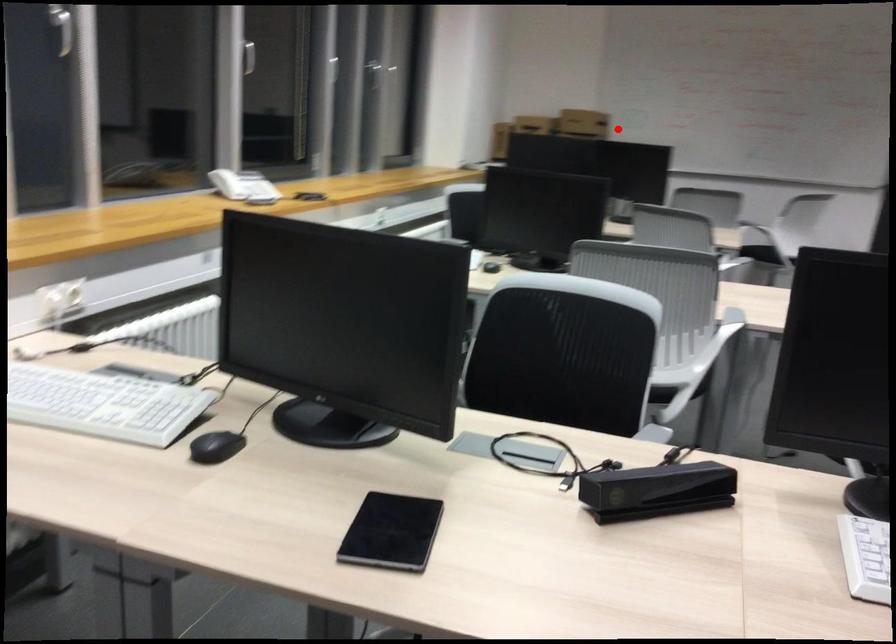
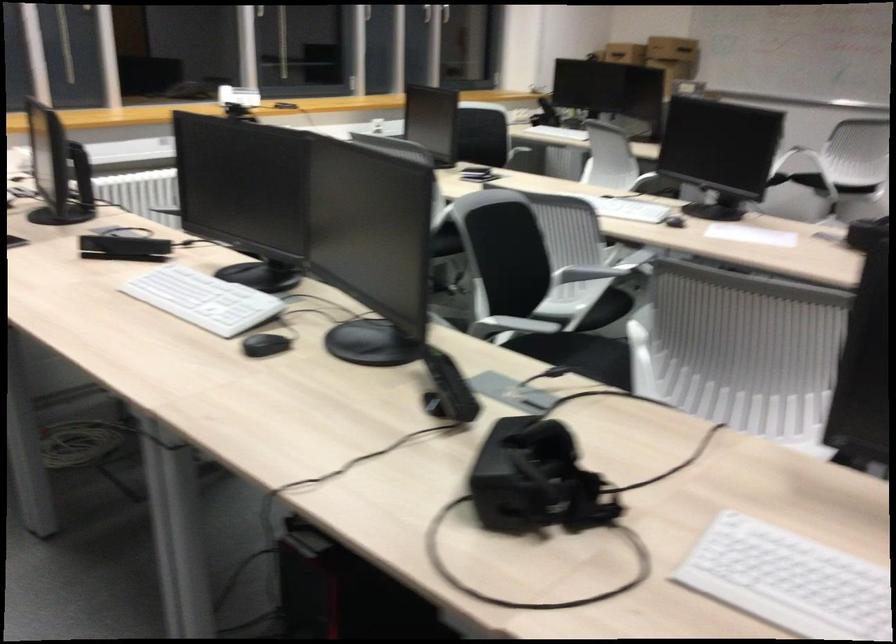
Where in the second image is the point corresponding to the highlighted location from the first image?

(672, 49)